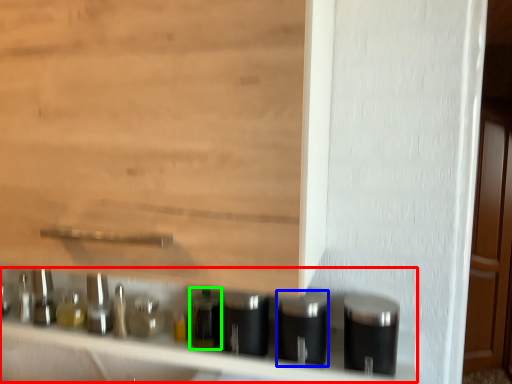
Question: Which is farther away from shelf (highlighted by a red box)? silver (highlighted by a blue box) or bottle (highlighted by a green box)?

Choices:
 (A) silver
 (B) bottle

Answer: (A)